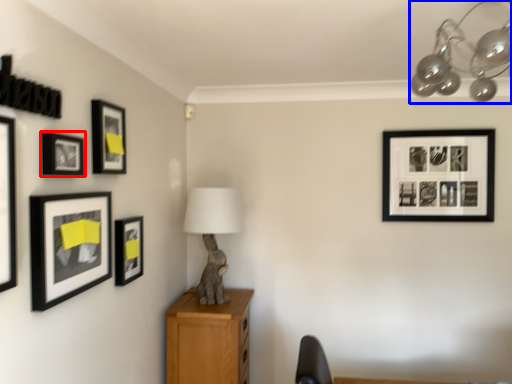
Question: Which of the following is the farthest to the observer, picture frame (highlighted by a red box) or lamp (highlighted by a blue box)?

Choices:
 (A) picture frame
 (B) lamp

Answer: (A)